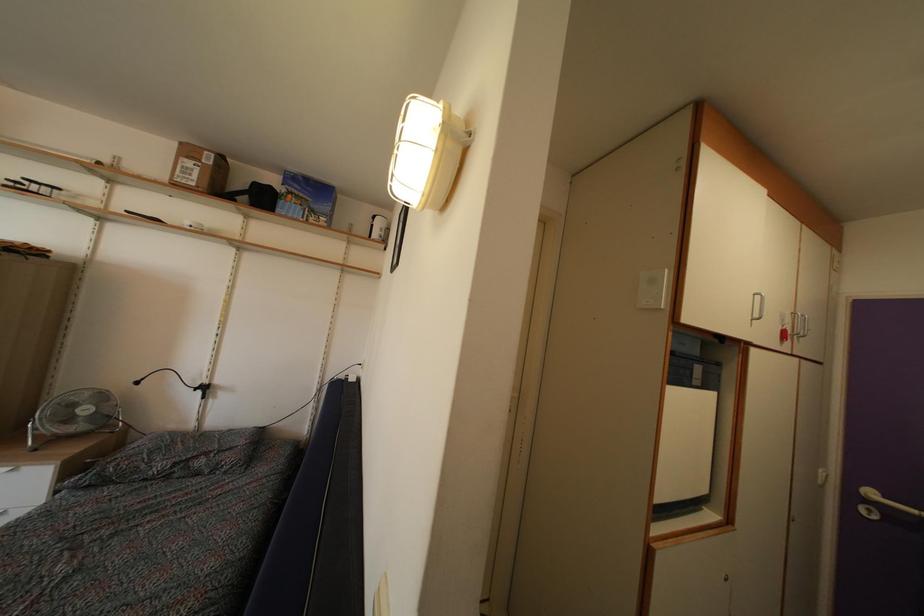
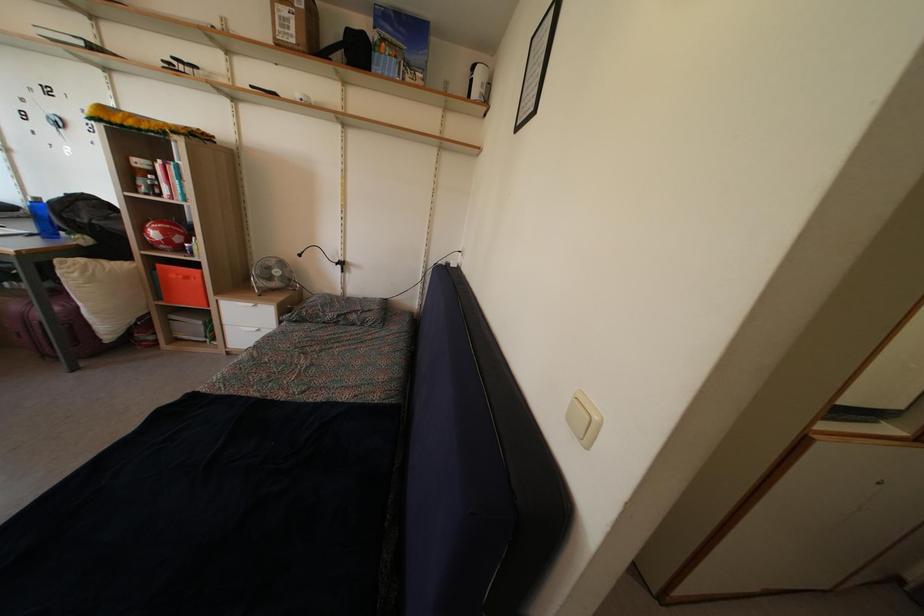
Consider the image. First-person continuous shooting, in which direction is the camera rotating?

The rotation direction of the camera is left-down.